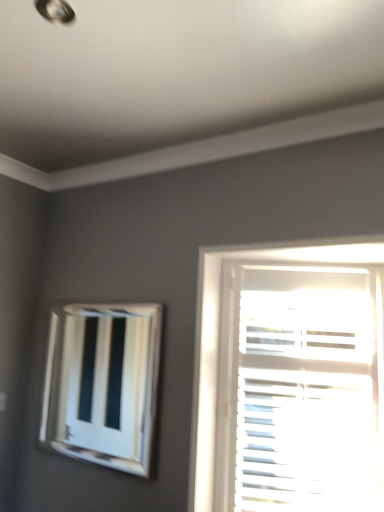
Question: From the image's perspective, does white glossy vent at upper left appear lower than white matte blinds at right?

Choices:
 (A) no
 (B) yes

Answer: (A)

Question: Is white glossy vent at upper left bigger than white matte blinds at right?

Choices:
 (A) yes
 (B) no

Answer: (B)

Question: From a real-world perspective, is white glossy vent at upper left physically above white matte blinds at right?

Choices:
 (A) yes
 (B) no

Answer: (A)

Question: Considering the relative positions of white glossy vent at upper left and white matte blinds at right in the image provided, is white glossy vent at upper left in front of white matte blinds at right?

Choices:
 (A) yes
 (B) no

Answer: (B)

Question: Does white glossy vent at upper left turn towards white matte blinds at right?

Choices:
 (A) yes
 (B) no

Answer: (B)

Question: Would you say white glossy vent at upper left is a long distance from white matte blinds at right?

Choices:
 (A) no
 (B) yes

Answer: (B)

Question: From the image's perspective, is white matte blinds at right under white glossy vent at upper left?

Choices:
 (A) no
 (B) yes

Answer: (B)

Question: Considering the relative sizes of white matte blinds at right and white glossy vent at upper left in the image provided, is white matte blinds at right thinner than white glossy vent at upper left?

Choices:
 (A) yes
 (B) no

Answer: (B)

Question: Is the position of white matte blinds at right less distant than that of white glossy vent at upper left?

Choices:
 (A) yes
 (B) no

Answer: (A)

Question: Would you say white glossy vent at upper left is part of white matte blinds at right's contents?

Choices:
 (A) no
 (B) yes

Answer: (A)

Question: Is white matte blinds at right further to the viewer compared to white glossy vent at upper left?

Choices:
 (A) yes
 (B) no

Answer: (B)

Question: From a real-world perspective, is white matte blinds at right physically below white glossy vent at upper left?

Choices:
 (A) no
 (B) yes

Answer: (B)

Question: From the image's perspective, is white glossy vent at upper left positioned above or below white matte blinds at right?

Choices:
 (A) above
 (B) below

Answer: (A)